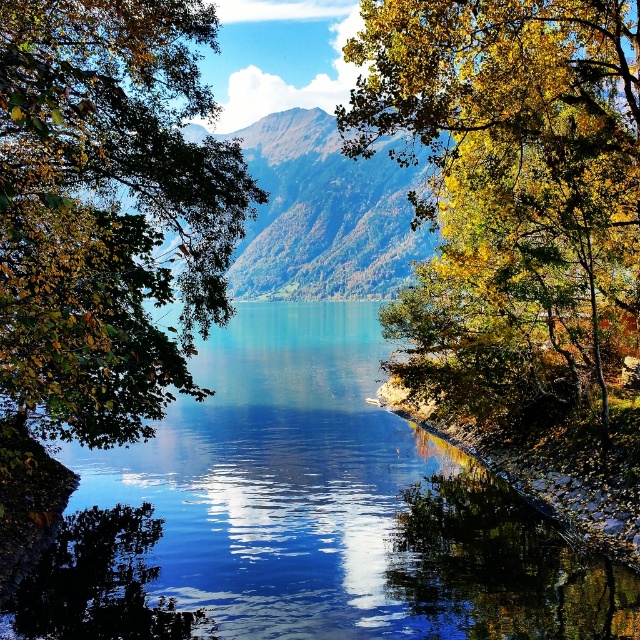
Which is behind, point (497, 324) or point (280, 129)?

Positioned behind is point (280, 129).

Who is more distant from viewer, (529, 45) or (410, 259)?

Point (410, 259)

Where is `yellow-green leafy tree at upper right`? The image size is (640, 640). yellow-green leafy tree at upper right is located at coordinates (516, 164).

Is transparent water at center thinner than yellow-green leafy tree at upper right?

No, transparent water at center is not thinner than yellow-green leafy tree at upper right.

Does transparent water at center lie in front of yellow-green leafy tree at upper right?

That is True.

Who is more distant from viewer, (449, 518) or (584, 289)?

The point (584, 289) is more distant.

Where is `transparent water at center`? The width and height of the screenshot is (640, 640). transparent water at center is located at coordinates (305, 513).

Between point (228, 310) and point (280, 156), which one is positioned in front?

Positioned in front is point (228, 310).

Where is `green leafy tree at left`? The image size is (640, 640). green leafy tree at left is located at coordinates (106, 212).

Between point (77, 416) and point (362, 170), which one is positioned in front?

Positioned in front is point (77, 416).

Locate an element on the screen. The height and width of the screenshot is (640, 640). green leafy tree at left is located at coordinates (106, 212).